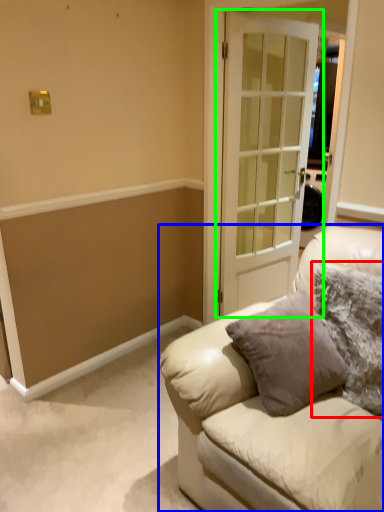
Question: Estimate the real-world distances between objects in this image. Which object is farther from pillow (highlighted by a red box), studio couch (highlighted by a blue box) or door (highlighted by a green box)?

Choices:
 (A) studio couch
 (B) door

Answer: (B)